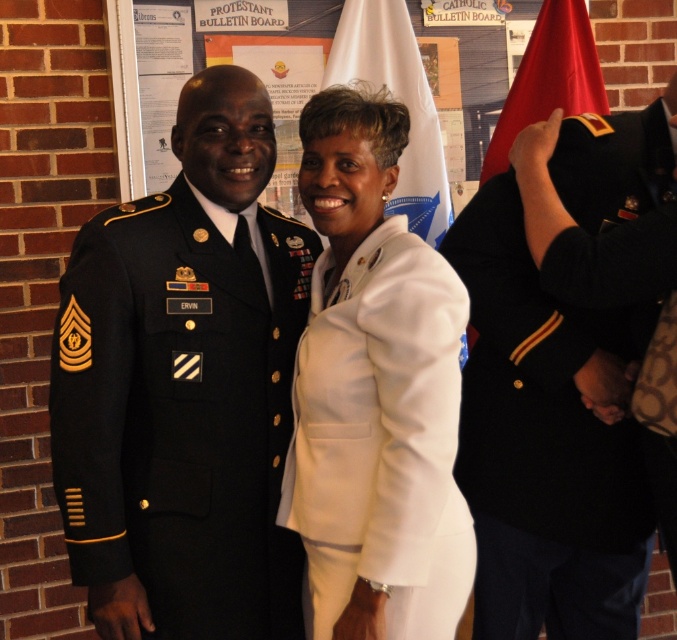
You are a photographer adjusting the camera focus. The navy blue wool military uniform at right and the shiny red flag at upper right are both in the frame. Which object is closer to the camera?

The navy blue wool military uniform at right is closer to the camera because it is only 23.89 inches away from the shiny red flag at upper right, meaning the uniform is nearer than the flag.

You are attending a military ceremony and notice a white fabric flag at upper center. Where exactly is it positioned in relation to the two central individuals?

The white fabric flag at upper center is located at coordinates point (397, 100), which places it slightly to the upper left of the two central individuals.

You are a photographer at the event and need to ensure both the navy blue wool military uniform at right and the shiny red flag at upper right are in focus. Based on their positions, which object is wider and thus requires a different focus setting?

The navy blue wool military uniform at right might be wider than shiny red flag at upper right according to the description, so it requires a different focus setting due to its width.